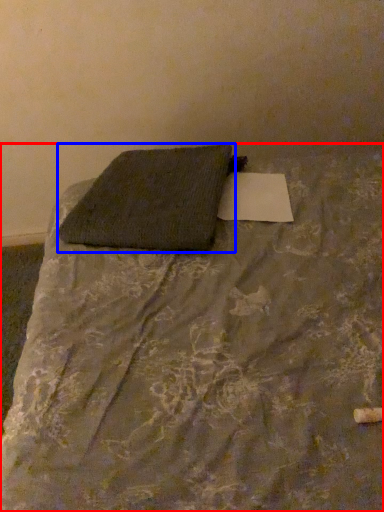
Question: Which object is closer to the camera taking this photo, bed (highlighted by a red box) or pillow (highlighted by a blue box)?

Choices:
 (A) bed
 (B) pillow

Answer: (A)